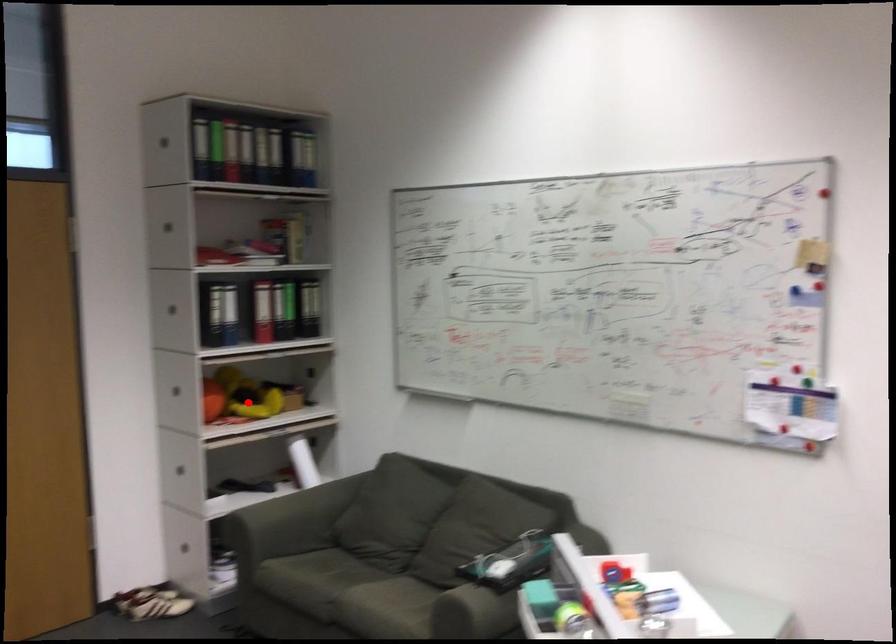
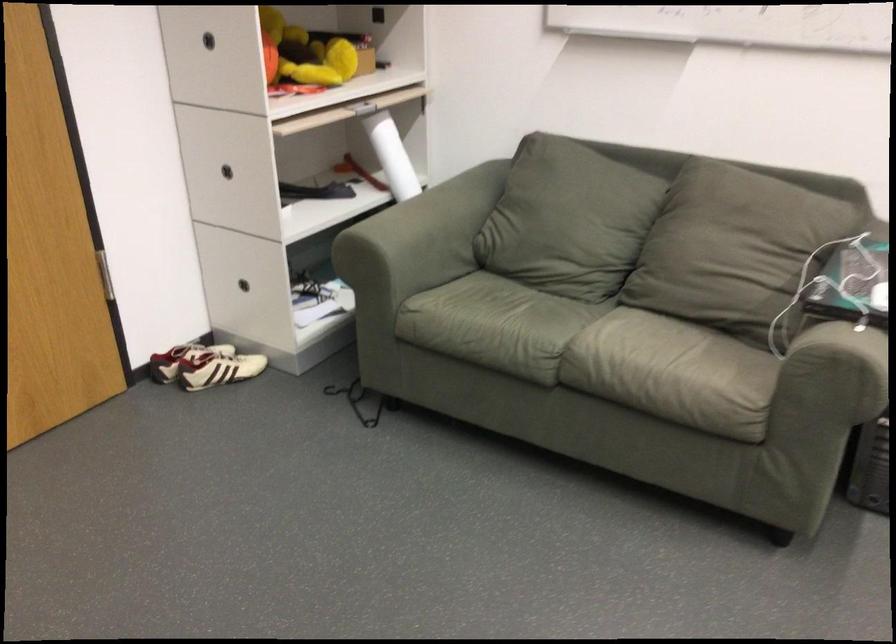
Question: I am providing you with two images of the same scene from different viewpoints. A red point is shown in image1. For the corresponding object point in image2, is it positioned nearer or farther from the camera?

Choices:
 (A) Nearer
 (B) Farther

Answer: (A)